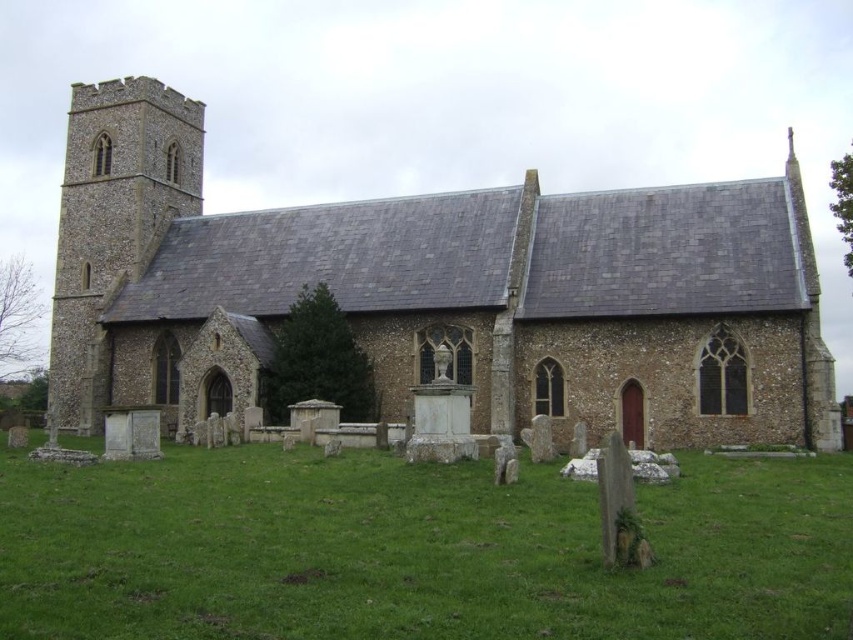
Question: Where is green grass at lower center located in relation to brown stone tower at left in the image?

Choices:
 (A) below
 (B) above

Answer: (A)

Question: Which is farther from the brown stone church at center?

Choices:
 (A) brown stone tower at left
 (B) green grass at lower center

Answer: (B)

Question: Is green grass at lower center above brown stone tower at left?

Choices:
 (A) yes
 (B) no

Answer: (B)

Question: Estimate the real-world distances between objects in this image. Which object is closer to the brown stone tower at left?

Choices:
 (A) brown stone church at center
 (B) green grass at lower center

Answer: (A)

Question: Does green grass at lower center come behind brown stone tower at left?

Choices:
 (A) yes
 (B) no

Answer: (B)

Question: Which of these objects is positioned farthest from the brown stone tower at left?

Choices:
 (A) brown stone church at center
 (B) green grass at lower center

Answer: (B)